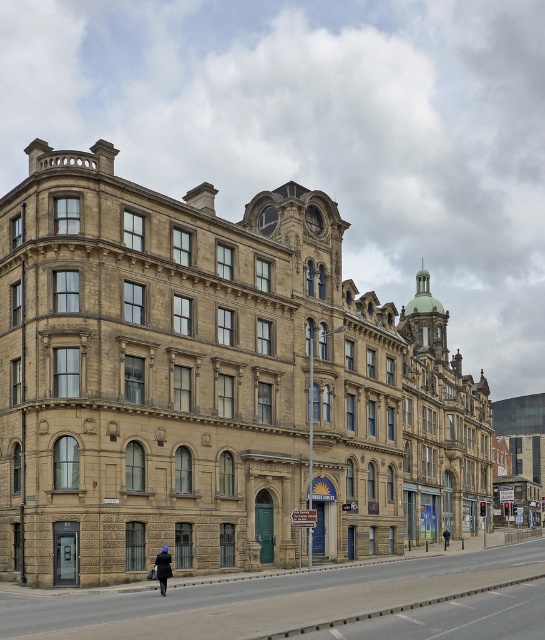
You are a tailor who needs to determine which clothing item requires more fabric for alterations. Based on the sizes of the dark blue fabric coat at lower center and the black fabric jacket at center, which one would need more fabric?

The black fabric jacket at center requires more fabric because it is larger in size than the dark blue fabric coat at lower center.